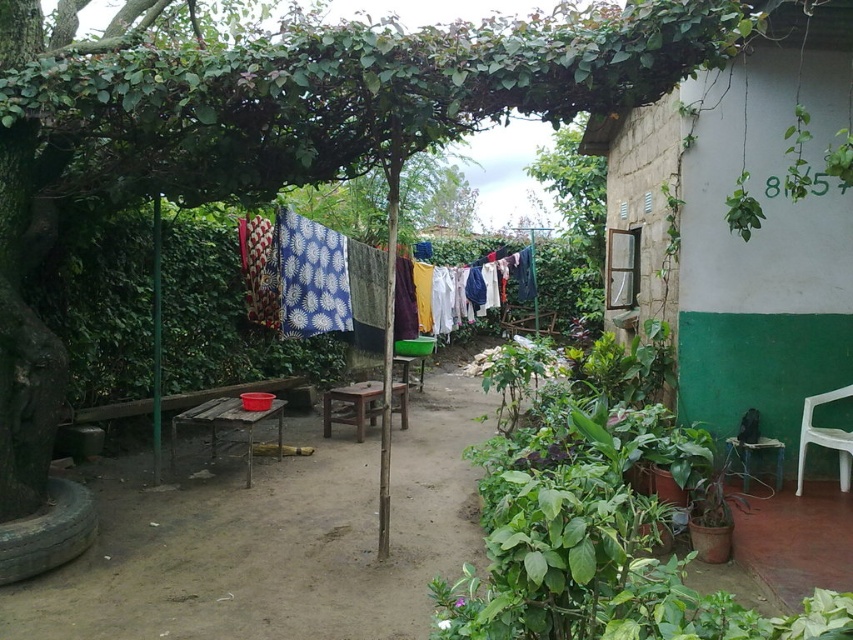
Question: Can you confirm if dull wood table at center is thinner than green concrete wall at right?

Choices:
 (A) yes
 (B) no

Answer: (B)

Question: Which point is closer to the camera?

Choices:
 (A) dull wood table at center
 (B) printed fabric clothes at center

Answer: (A)

Question: Among these objects, which one is farthest from the camera?

Choices:
 (A) dull wood table at center
 (B) green concrete wall at right
 (C) printed fabric clothes at center

Answer: (C)

Question: Which of the following is the closest to the observer?

Choices:
 (A) (335, 280)
 (B) (747, 328)
 (C) (386, 568)

Answer: (C)

Question: Can you confirm if dull wood table at center is positioned below green concrete wall at right?

Choices:
 (A) yes
 (B) no

Answer: (A)

Question: Does green concrete wall at right appear on the right side of printed fabric clothes at center?

Choices:
 (A) yes
 (B) no

Answer: (A)